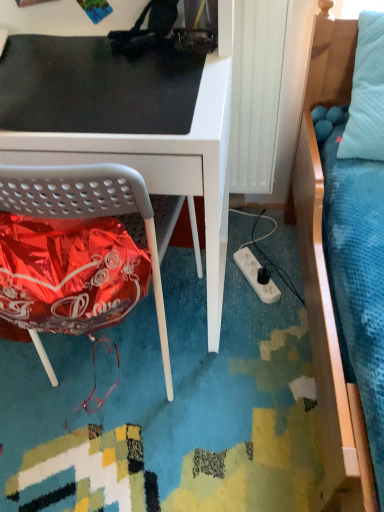
Identify the location of free space above black matte mousepad at upper left (from a real-world perspective). [x=76, y=72].